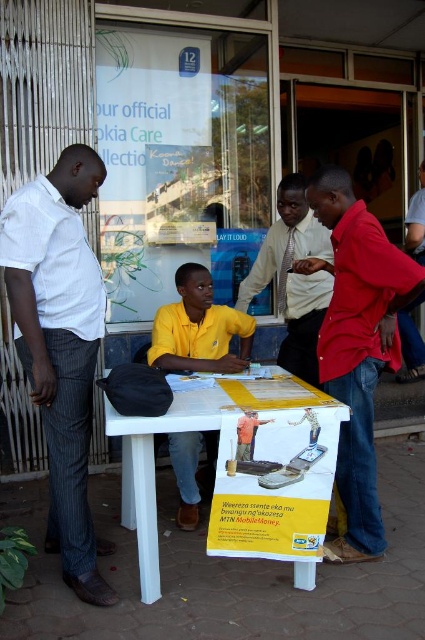
Question: Which point is closer to the camera taking this photo?

Choices:
 (A) (309, 333)
 (B) (153, 456)
 (C) (34, 252)

Answer: (C)

Question: Is white pinstripe pants at left to the left of white plastic table at center from the viewer's perspective?

Choices:
 (A) no
 (B) yes

Answer: (B)

Question: Which object is farther from the camera taking this photo?

Choices:
 (A) matte red shirt at center
 (B) white pinstripe pants at left

Answer: (B)

Question: Is matte red shirt at center to the right of white plastic table at center from the viewer's perspective?

Choices:
 (A) yes
 (B) no

Answer: (A)

Question: Does matte red shirt at center lie behind yellow matte shirt at center?

Choices:
 (A) no
 (B) yes

Answer: (A)

Question: Which is nearer to the white plastic table at center?

Choices:
 (A) yellow matte shirt at center
 (B) matte red shirt at center

Answer: (A)